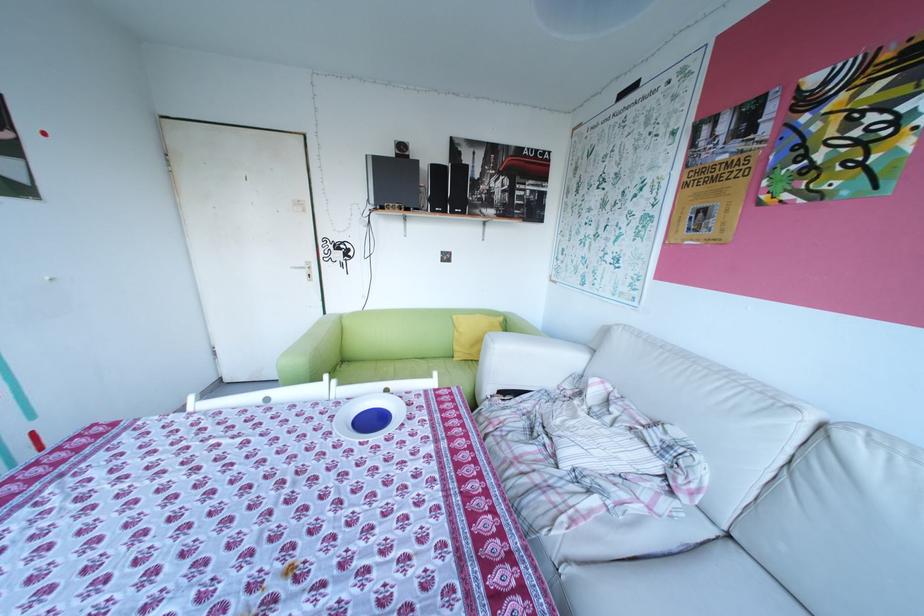
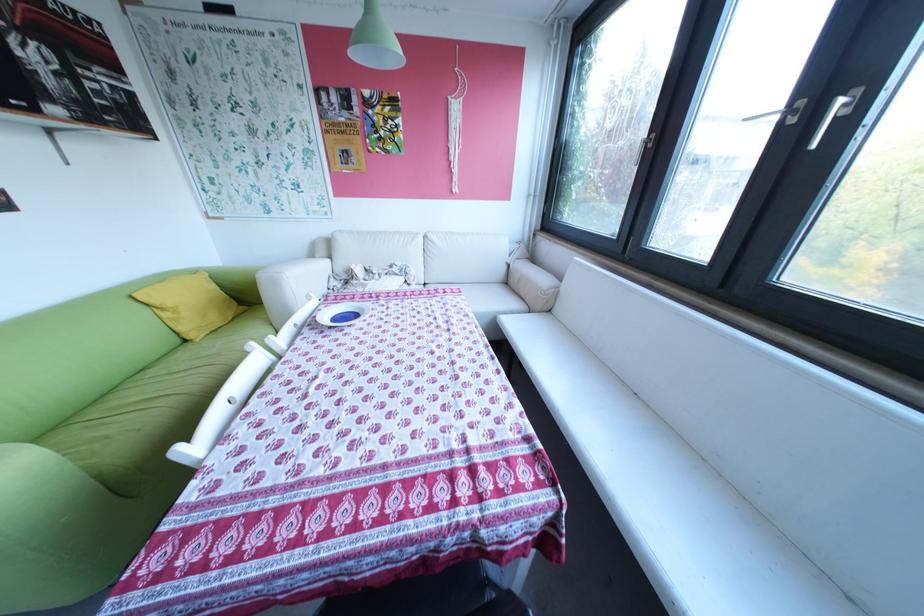
Locate, in the second image, the point that corresponds to point 743,536 in the first image.

(438, 284)